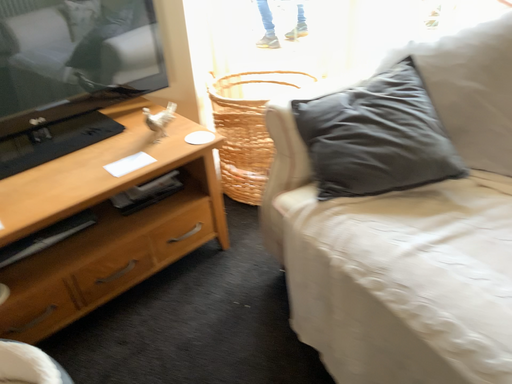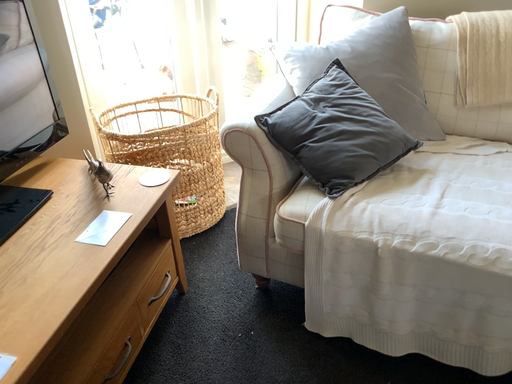
Question: How did the camera likely rotate when shooting the video?

Choices:
 (A) rotated right
 (B) rotated left

Answer: (A)